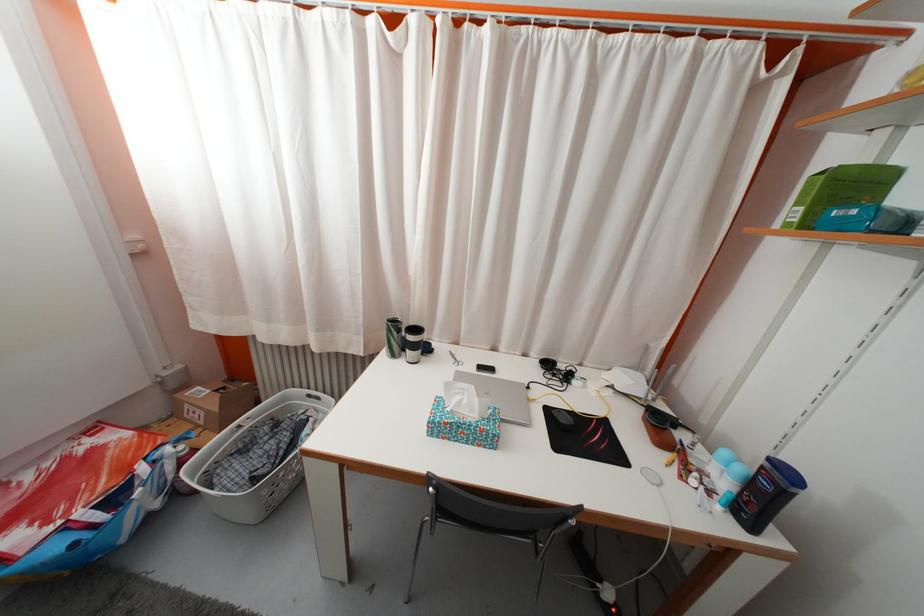
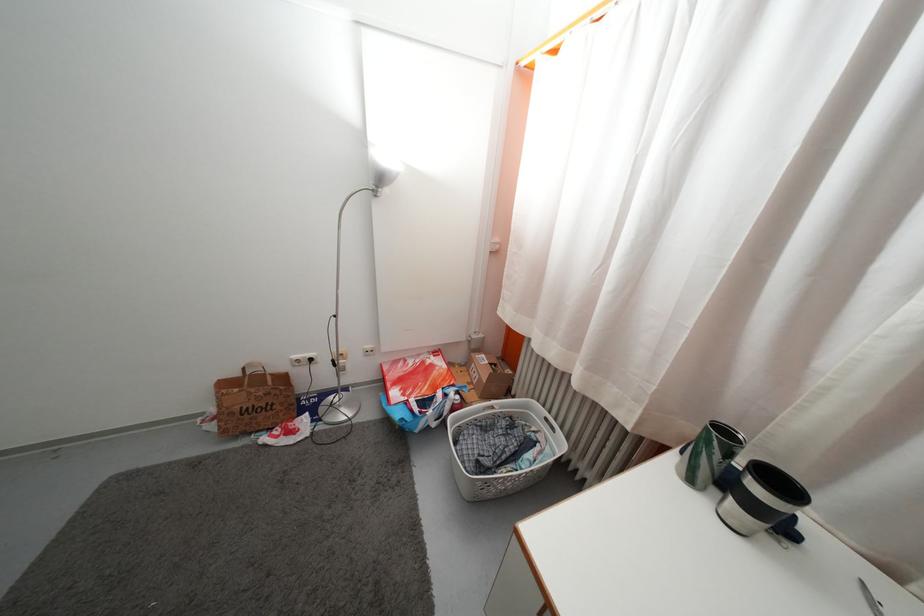
Where in the second image is the point corresponding to point 432,357 from the first image?

(791, 537)